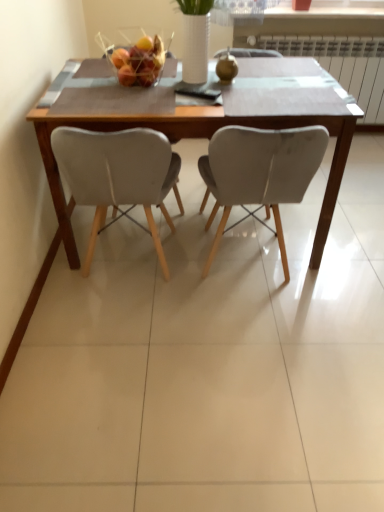
The image size is (384, 512). In order to click on blank space situated above white plastic radiator at upper right (from a real-world perspective) in this screenshot , I will do pos(314,35).